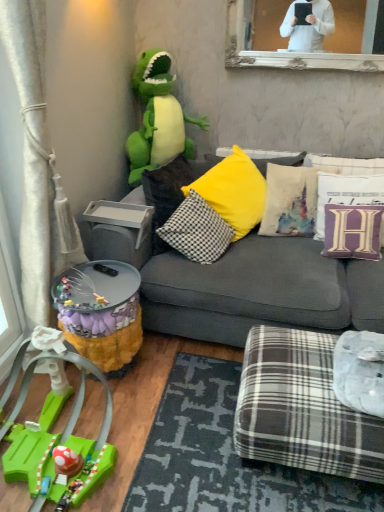
Question: Is gray fabric couch at center inside the boundaries of textured white pillow at center right, which is the second pillow in left-to-right order, or outside?

Choices:
 (A) inside
 (B) outside

Answer: (B)

Question: Is point (291, 162) closer or farther from the camera than point (288, 190)?

Choices:
 (A) closer
 (B) farther

Answer: (B)

Question: Considering the real-world distances, which object is closest to the plaid fabric ottoman at lower right?

Choices:
 (A) dark gray textured mat at lower center
 (B) purple velvet pillow at upper right, which appears as the second pillow when viewed from the right
 (C) fuzzy yellow side table at lower left
 (D) purple velvet pillow at upper right, the first pillow from the right
 (E) textured white pillow at center right, arranged as the third pillow when viewed from the right

Answer: (A)

Question: Considering the real-world distances, which object is farthest from the green plush dinosaur at upper left, the 2th toy from the bottom?

Choices:
 (A) gray plastic tray at lower left
 (B) textured white pillow at center right, arranged as the third pillow when viewed from the right
 (C) black-and-white checkered pillow at center, which is counted as the 4th pillow, starting from the right
 (D) gray fabric couch at center
 (E) dark gray textured mat at lower center

Answer: (E)